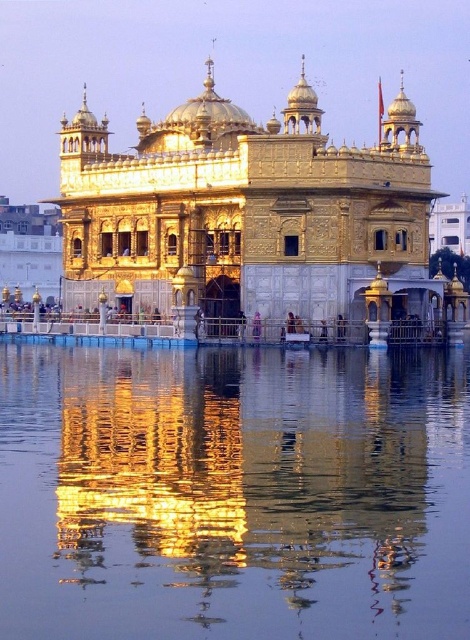
Does transparent liquid water at center lie in front of golden polished temple at center?

Yes, transparent liquid water at center is in front of golden polished temple at center.

In the scene shown: Is transparent liquid water at center shorter than golden polished temple at center?

Indeed, transparent liquid water at center has a lesser height compared to golden polished temple at center.

What are the coordinates of `transparent liquid water at center` in the screenshot? It's located at (234, 493).